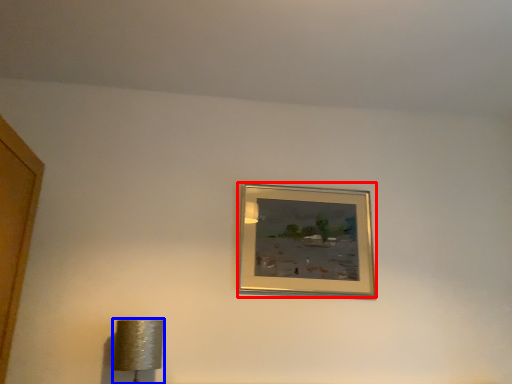
Question: Which point is closer to the camera, picture frame (highlighted by a red box) or lamp (highlighted by a blue box)?

Choices:
 (A) picture frame
 (B) lamp

Answer: (B)